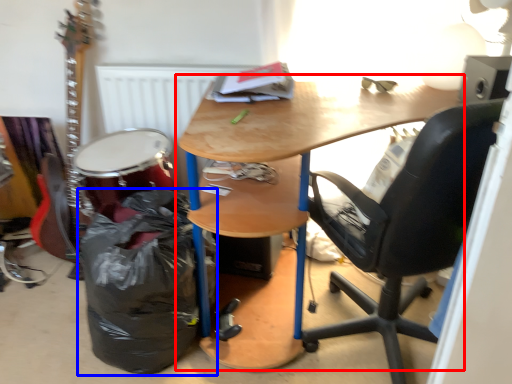
Question: Among these objects, which one is nearest to the camera, desk (highlighted by a red box) or garbage (highlighted by a blue box)?

Choices:
 (A) desk
 (B) garbage

Answer: (A)